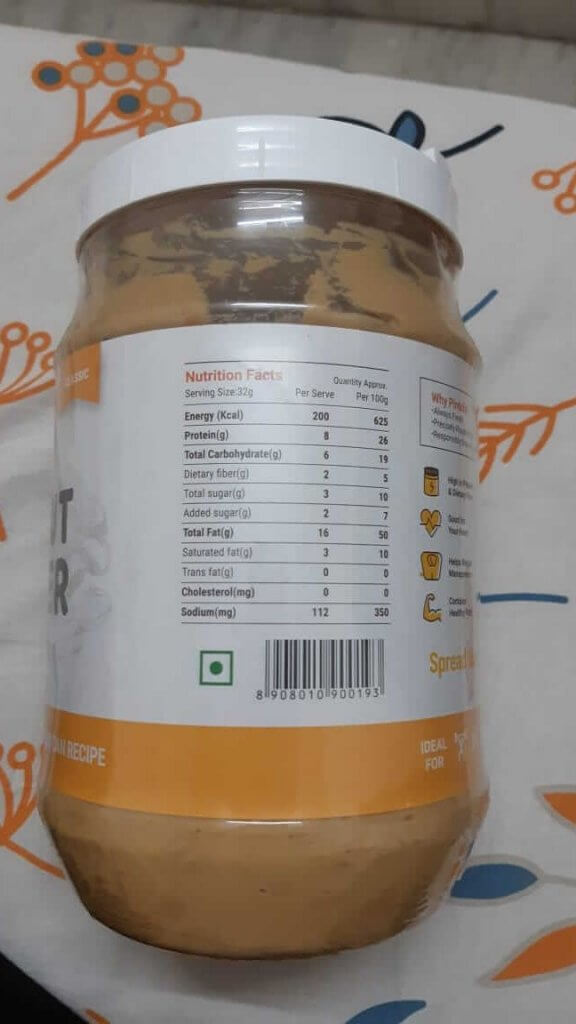
The width and height of the screenshot is (576, 1024). I want to click on jar, so (x=206, y=699).